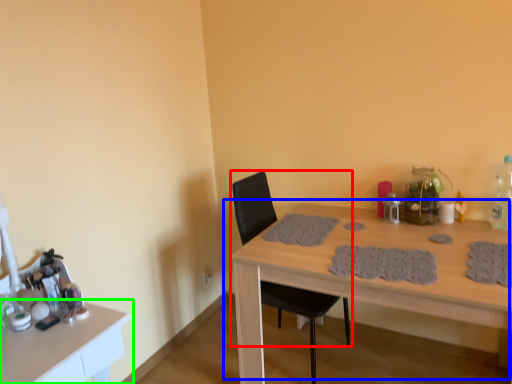
Question: Based on their relative distances, which object is nearer to chair (highlighted by a red box)? Choose from table (highlighted by a blue box) and table (highlighted by a green box).

Choices:
 (A) table
 (B) table

Answer: (A)